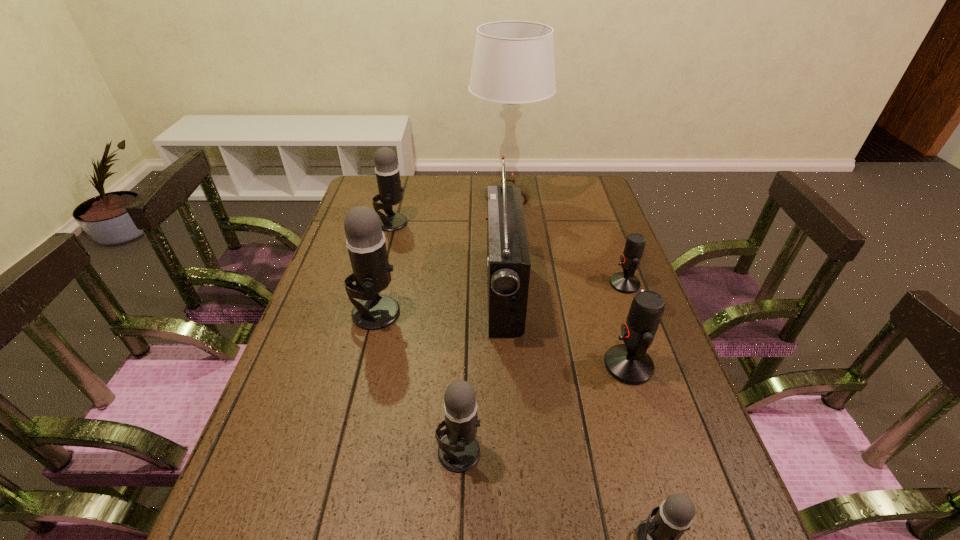
Identify the location of the tallest object. tap(513, 63).

Image resolution: width=960 pixels, height=540 pixels. What are the coordinates of `radio receiver` in the screenshot? It's located at (508, 260).

At what (x,y) coordinates should I click in order to perform the action: click on the third farthest microphone. Please return your answer as a coordinate pair (x, y). Looking at the image, I should click on (365, 242).

Where is `the tallest microphone`? This screenshot has width=960, height=540. the tallest microphone is located at coordinates (365, 242).

Where is `the second tallest microphone`? The height and width of the screenshot is (540, 960). the second tallest microphone is located at coordinates (387, 170).

Identify the location of the farthest gray microphone. The height and width of the screenshot is (540, 960). (387, 170).

Identify the location of the bigger red microphone. This screenshot has height=540, width=960. (629, 363).

In order to click on the fourth farthest microphone in this screenshot , I will do `click(629, 363)`.

Identify the location of the seventh farthest object. (459, 451).

Where is `the fifth farthest microphone`? The height and width of the screenshot is (540, 960). the fifth farthest microphone is located at coordinates (459, 451).